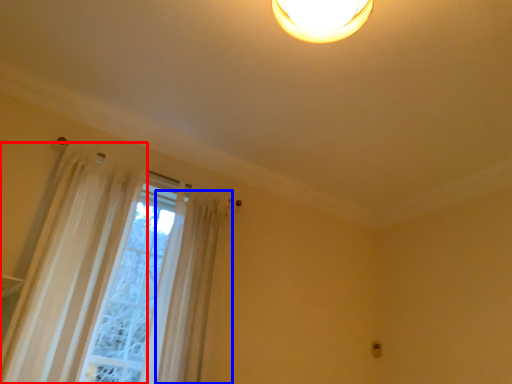
Question: Which of the following is the farthest to the observer, curtain (highlighted by a red box) or shower curtain (highlighted by a blue box)?

Choices:
 (A) curtain
 (B) shower curtain

Answer: (B)